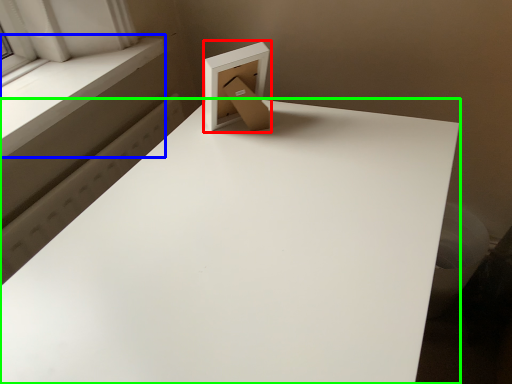
Question: Based on their relative distances, which object is farther from cardboard box (highlighted by a red box)? Choose from window sill (highlighted by a blue box) and table (highlighted by a green box).

Choices:
 (A) window sill
 (B) table

Answer: (A)